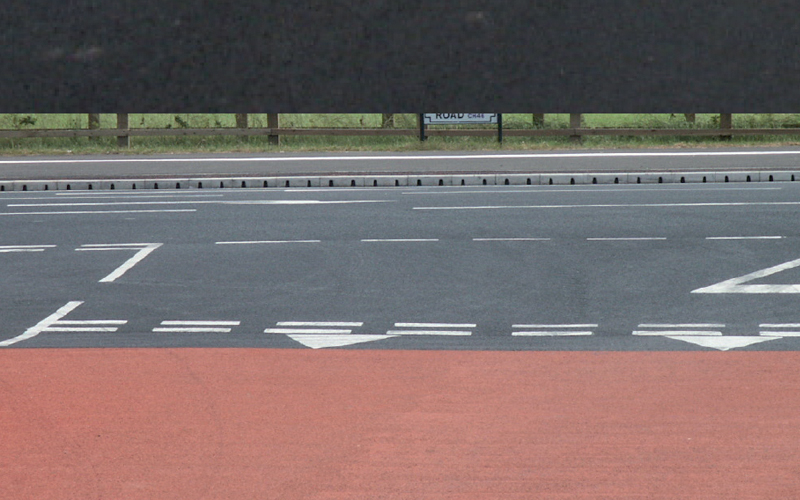
You are a GUI agent. You are given a task and a screenshot of the screen. Output one action in this format:
    pyautogui.click(x=<x>, y=<y>)
    Task: Click on the corners
    
    Given the screenshot: What is the action you would take?
    pyautogui.click(x=785, y=488), pyautogui.click(x=776, y=19), pyautogui.click(x=18, y=480), pyautogui.click(x=18, y=53)